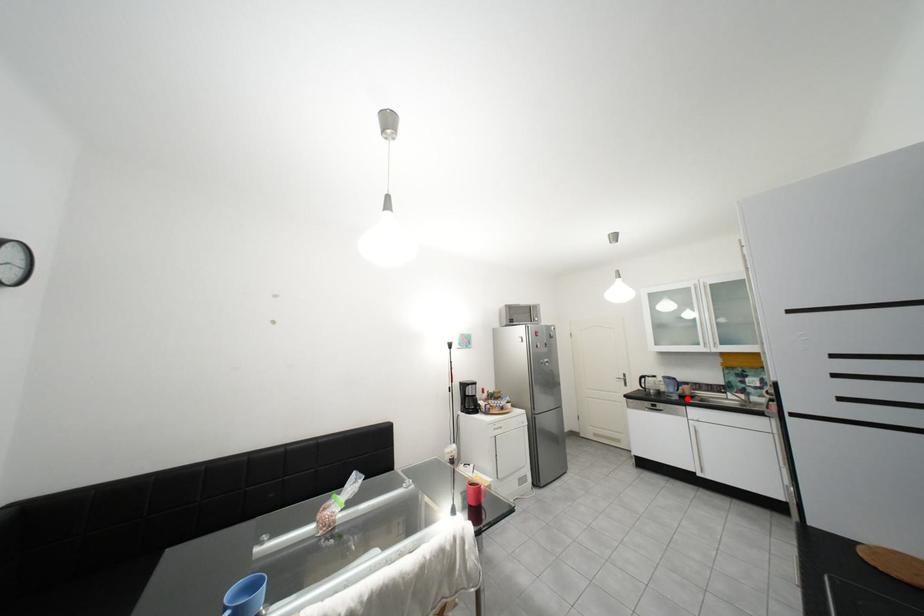
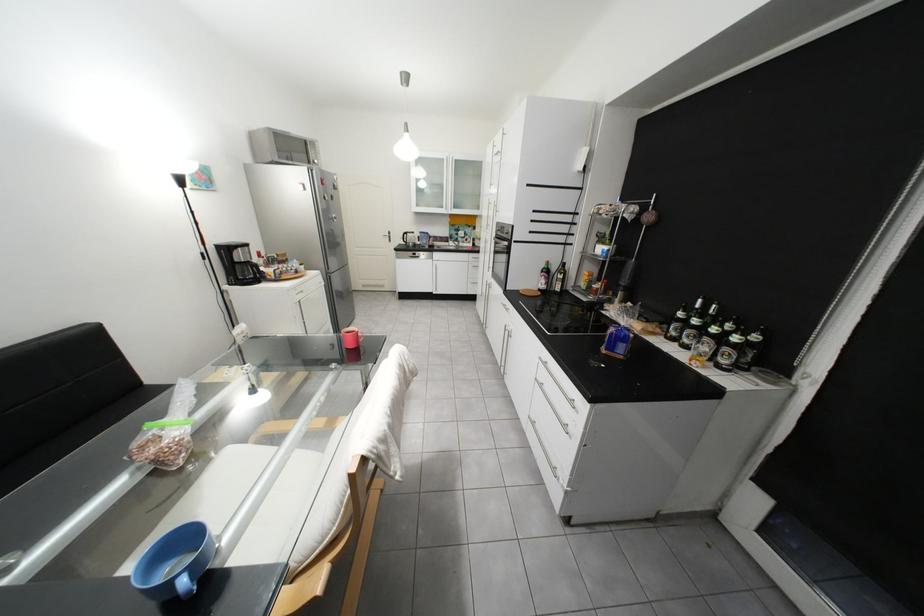
Question: I am providing you with two images of the same scene from different viewpoints. Image1 has a red point marked. In image2, the corresponding 3D location appears at what relative position? Reply with the corresponding letter.

Choices:
 (A) Closer
 (B) Farther

Answer: (A)